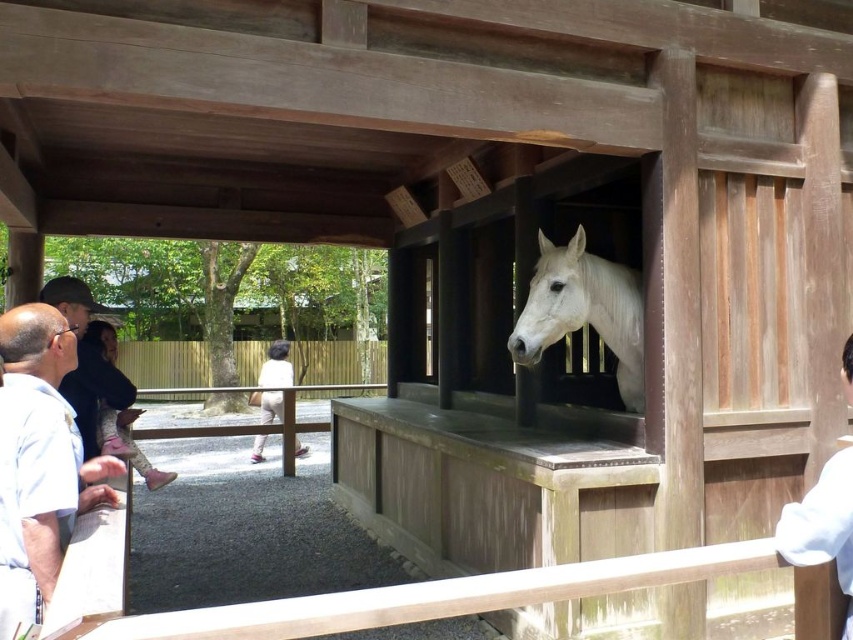
Can you confirm if white uniform at left is positioned above bald head at left?

No.

Does white uniform at left have a larger size compared to bald head at left?

Yes.

Locate an element on the screen. white uniform at left is located at coordinates (39, 461).

Between point (640, 337) and point (49, 364), which one is positioned in front?

Positioned in front is point (49, 364).

Is point (566, 296) closer to camera compared to point (19, 310)?

No, (566, 296) is behind (19, 310).

Where is `white glossy horse at center`? The width and height of the screenshot is (853, 640). white glossy horse at center is located at coordinates (583, 310).

Which is in front, point (74, 332) or point (849, 396)?

Positioned in front is point (849, 396).

Is point (64, 301) less distant than point (850, 392)?

No, (64, 301) is further to viewer.

Measure the distance between matte black cap at upper left and camera.

A distance of 2.71 meters exists between matte black cap at upper left and camera.

The image size is (853, 640). I want to click on matte black cap at upper left, so [70, 300].